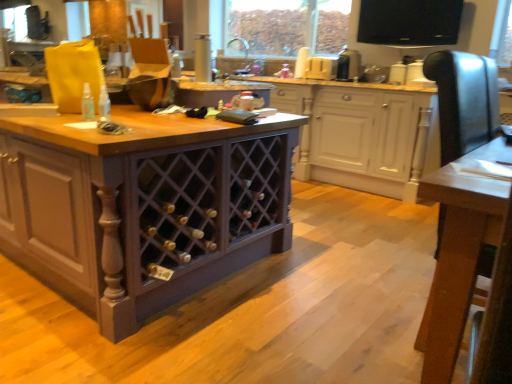
Question: Is purple wood wine rack at center, the 1th cabinetry when ordered from front to back, outside of black plastic toaster at upper center?

Choices:
 (A) no
 (B) yes

Answer: (B)

Question: Can you confirm if purple wood wine rack at center, which appears as the second cabinetry when viewed from the back, is shorter than black plastic toaster at upper center?

Choices:
 (A) no
 (B) yes

Answer: (A)

Question: From the image's perspective, is purple wood wine rack at center, which appears as the second cabinetry when viewed from the back, below black plastic toaster at upper center?

Choices:
 (A) yes
 (B) no

Answer: (A)

Question: From a real-world perspective, is purple wood wine rack at center, which appears as the second cabinetry when viewed from the back, physically above black plastic toaster at upper center?

Choices:
 (A) no
 (B) yes

Answer: (A)

Question: Is purple wood wine rack at center, which appears as the second cabinetry when viewed from the back, at the left side of black plastic toaster at upper center?

Choices:
 (A) no
 (B) yes

Answer: (B)

Question: From a real-world perspective, does wooden table at center sit lower than purple wood wine rack at center, which appears as the second cabinetry when viewed from the back?

Choices:
 (A) no
 (B) yes

Answer: (B)

Question: Does wooden table at center have a lesser height compared to purple wood wine rack at center, which appears as the second cabinetry when viewed from the back?

Choices:
 (A) no
 (B) yes

Answer: (B)

Question: Can you see wooden table at center touching purple wood wine rack at center, the 1th cabinetry when ordered from front to back?

Choices:
 (A) yes
 (B) no

Answer: (B)

Question: Considering the relative sizes of wooden table at center and purple wood wine rack at center, the 1th cabinetry when ordered from front to back, in the image provided, is wooden table at center taller than purple wood wine rack at center, the 1th cabinetry when ordered from front to back,?

Choices:
 (A) no
 (B) yes

Answer: (A)

Question: Does wooden table at center have a smaller size compared to purple wood wine rack at center, the 1th cabinetry when ordered from front to back?

Choices:
 (A) yes
 (B) no

Answer: (A)

Question: Is purple wood wine rack at center, the 1th cabinetry when ordered from front to back, a part of wooden table at center?

Choices:
 (A) no
 (B) yes

Answer: (A)

Question: Does translucent plastic spray bottle at center have a smaller size compared to purple wood wine rack at center, the second cabinetry positioned from the front?

Choices:
 (A) yes
 (B) no

Answer: (A)